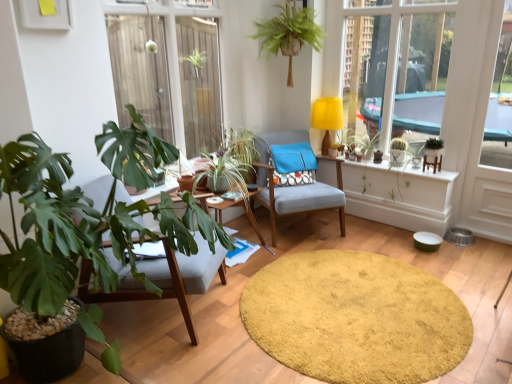
What do you see at coordinates (185, 274) in the screenshot? I see `matte gray chair at left, which is the 2th chair in back-to-front order` at bounding box center [185, 274].

Locate an element on the screen. The width and height of the screenshot is (512, 384). green leafy plant at upper center, the 3th houseplant in the left-to-right sequence is located at coordinates (288, 33).

Describe the element at coordinates (403, 154) in the screenshot. I see `green matte cactus at upper right, which appears as the 2th plant when viewed from the left` at that location.

This screenshot has height=384, width=512. In order to click on green leafy plant at right, which appears as the first houseplant when viewed from the right in this screenshot , I will do `click(433, 149)`.

How much space does green leafy plant at upper right, which ranks as the 2th plant in right-to-left order, occupy horizontally?

green leafy plant at upper right, which ranks as the 2th plant in right-to-left order, is 12.29 inches wide.

This screenshot has height=384, width=512. Describe the element at coordinates (366, 147) in the screenshot. I see `green leafy plant at upper right, which ranks as the 2th plant in right-to-left order` at that location.

Where is `matte gray chair at left, arranged as the first chair when viewed from the front`? This screenshot has width=512, height=384. matte gray chair at left, arranged as the first chair when viewed from the front is located at coordinates (185, 274).

Is green leafy plant at upper center, positioned as the 4th houseplant in back-to-front order, oriented away from woodenobject at center?

green leafy plant at upper center, positioned as the 4th houseplant in back-to-front order, is not turned away from woodenobject at center.

From the picture: Is green leafy plant at upper center, the 3th houseplant in the left-to-right sequence, outside of woodenobject at center?

green leafy plant at upper center, the 3th houseplant in the left-to-right sequence, lies outside woodenobject at center's area.

Which object is closer to the camera, green leafy plant at upper center, placed as the second houseplant when sorted from front to back, or woodenobject at center?

Positioned in front is woodenobject at center.

From a real-world perspective, is yellow fabric lampshade at upper center physically above green leafy plant at upper right, the 1th plant in the left-to-right sequence?

Yes, from a real-world perspective, yellow fabric lampshade at upper center is over green leafy plant at upper right, the 1th plant in the left-to-right sequence

Considering the sizes of yellow fabric lampshade at upper center and green leafy plant at upper right, the 1th plant in the left-to-right sequence, in the image, is yellow fabric lampshade at upper center bigger or smaller than green leafy plant at upper right, the 1th plant in the left-to-right sequence,?

Clearly, yellow fabric lampshade at upper center is smaller in size than green leafy plant at upper right, the 1th plant in the left-to-right sequence.

Is yellow fabric lampshade at upper center positioned far away from green leafy plant at upper right, the 1th plant in the left-to-right sequence?

yellow fabric lampshade at upper center is actually quite close to green leafy plant at upper right, the 1th plant in the left-to-right sequence.

Between green leafy plant at upper right, the 1th plant in the left-to-right sequence, and green matte cactus at upper right, which appears as the 2th plant when viewed from the left, which one appears on the right side from the viewer's perspective?

From the viewer's perspective, green matte cactus at upper right, which appears as the 2th plant when viewed from the left, appears more on the right side.

Considering the relative sizes of green leafy plant at upper right, which ranks as the 2th plant in right-to-left order, and green matte cactus at upper right, which appears as the 2th plant when viewed from the left, in the image provided, is green leafy plant at upper right, which ranks as the 2th plant in right-to-left order, shorter than green matte cactus at upper right, which appears as the 2th plant when viewed from the left,?

Incorrect, the height of green leafy plant at upper right, which ranks as the 2th plant in right-to-left order, does not fall short of that of green matte cactus at upper right, which appears as the 2th plant when viewed from the left.

Based on the photo, from the image's perspective, would you say green leafy plant at upper right, which ranks as the 2th plant in right-to-left order, is positioned over green matte cactus at upper right, which appears as the first plant when viewed from the right?

Yes, from the image's perspective, green leafy plant at upper right, which ranks as the 2th plant in right-to-left order, is over green matte cactus at upper right, which appears as the first plant when viewed from the right.

From a real-world perspective, which is physically above, green leafy plant at upper right, which ranks as the 2th plant in right-to-left order, or green matte cactus at upper right, which appears as the first plant when viewed from the right?

In real-world perspective, green leafy plant at upper right, which ranks as the 2th plant in right-to-left order, is above.

Between blue fabric pillow at center and green leafy plant at right, the 3th houseplant from the back, which one has smaller size?

Smaller between the two is green leafy plant at right, the 3th houseplant from the back.

From a real-world perspective, is blue fabric pillow at center positioned above or below green leafy plant at right, which appears as the first houseplant when viewed from the right?

blue fabric pillow at center is situated lower than green leafy plant at right, which appears as the first houseplant when viewed from the right, in the real world.

Find the location of a particular element. houseplant that is the 4th one above the blue fabric pillow at center (from a real-world perspective) is located at coordinates (433, 149).

From the image's perspective, between blue fabric pillow at center and green leafy plant at right, acting as the third houseplant starting from the front, which one is located above?

From the image's view, green leafy plant at right, acting as the third houseplant starting from the front, is above.

In the scene shown: Considering the relative sizes of woodenobject at center and green leafy plant at upper right, which ranks as the 2th plant in right-to-left order, in the image provided, is woodenobject at center wider than green leafy plant at upper right, which ranks as the 2th plant in right-to-left order,?

Indeed, woodenobject at center has a greater width compared to green leafy plant at upper right, which ranks as the 2th plant in right-to-left order.

Where is `table below the green leafy plant at upper right, the 1th plant in the left-to-right sequence (from a real-world perspective)`? The height and width of the screenshot is (384, 512). table below the green leafy plant at upper right, the 1th plant in the left-to-right sequence (from a real-world perspective) is located at coordinates (229, 207).

From a real-world perspective, is woodenobject at center physically above green leafy plant at upper right, which ranks as the 2th plant in right-to-left order?

No, from a real-world perspective, woodenobject at center is not above green leafy plant at upper right, which ranks as the 2th plant in right-to-left order.

Which point is more forward, (159, 200) or (367, 139)?

Positioned in front is point (159, 200).

Who is smaller, green leafy plant at center, placed as the 2th houseplant when sorted from back to front, or textured fabric chair at center, which is the first chair from back to front?

Smaller between the two is green leafy plant at center, placed as the 2th houseplant when sorted from back to front.

Would you consider green leafy plant at center, the fourth houseplant when ordered from right to left, to be distant from textured fabric chair at center, positioned as the 2th chair in front-to-back order?

No, green leafy plant at center, the fourth houseplant when ordered from right to left, is not far away from textured fabric chair at center, positioned as the 2th chair in front-to-back order.

From a real-world perspective, is green leafy plant at center, the 2th houseplant viewed from the left, physically located above or below textured fabric chair at center, the second chair from the left?

Clearly, from a real-world perspective, green leafy plant at center, the 2th houseplant viewed from the left, is above textured fabric chair at center, the second chair from the left.

From the image's perspective, is green leafy plant at center, which ranks as the 4th houseplant in front-to-back order, on top of textured fabric chair at center, the 1th chair when ordered from right to left?

Indeed, from the image's perspective, green leafy plant at center, which ranks as the 4th houseplant in front-to-back order, is shown above textured fabric chair at center, the 1th chair when ordered from right to left.

Which object is positioned more to the left, yellow fabric at upper right or green leafy plant at left, the 5th houseplant viewed from the back?

green leafy plant at left, the 5th houseplant viewed from the back, is more to the left.

Considering the relative sizes of yellow fabric at upper right and green leafy plant at left, the 5th houseplant viewed from the back, in the image provided, is yellow fabric at upper right shorter than green leafy plant at left, the 5th houseplant viewed from the back,?

In fact, yellow fabric at upper right may be taller than green leafy plant at left, the 5th houseplant viewed from the back.

This screenshot has width=512, height=384. Find the location of `bay window behind the green leafy plant at left, the 5th houseplant viewed from the back`. bay window behind the green leafy plant at left, the 5th houseplant viewed from the back is located at coordinates (398, 62).

From a real-world perspective, who is located higher, yellow fabric at upper right or green leafy plant at left, placed as the first houseplant when sorted from left to right?

In real-world perspective, yellow fabric at upper right is above.

From the woodenobject at center, count 1st houseplants backward and point to it. Please provide its 2D coordinates.

[(288, 33)]

Identify the location of lamp to the left of green leafy plant at upper right, which ranks as the 2th plant in right-to-left order. The width and height of the screenshot is (512, 384). (327, 118).

Based on their spatial positions, is transparent glass window at upper left or yellow shaggy rug at center closer to green leafy plant at upper center, placed as the second houseplant when sorted from front to back?

Among the two, transparent glass window at upper left is located nearer to green leafy plant at upper center, placed as the second houseplant when sorted from front to back.

Which object lies further to the anchor point blue fabric pillow at center, transparent glass window at upper left or green leafy plant at upper right, which ranks as the 2th plant in right-to-left order?

transparent glass window at upper left lies further to blue fabric pillow at center than the other object.

When comparing their distances from yellow fabric at upper right, does matte gray chair at left, which is the 2th chair in back-to-front order, or green matte cactus at upper right, which appears as the first plant when viewed from the right, seem further?

matte gray chair at left, which is the 2th chair in back-to-front order, is further to yellow fabric at upper right.

Considering their positions, is green leafy plant at right, acting as the third houseplant starting from the front, positioned closer to yellow shaggy rug at center than woodenobject at center?

Based on the image, woodenobject at center appears to be nearer to yellow shaggy rug at center.

When comparing their distances from matte gray chair at left, which is the 2th chair in back-to-front order, does transparent glass window at upper left or green leafy plant at upper right, the 1th plant in the left-to-right sequence, seem closer?

transparent glass window at upper left.

Considering their positions, is green matte cactus at upper right, placed as the 1th houseplant when sorted from back to front, positioned closer to green leafy plant at left, the first houseplant from the front, than green leafy plant at center, which ranks as the 4th houseplant in front-to-back order?

Based on the image, green leafy plant at center, which ranks as the 4th houseplant in front-to-back order, appears to be nearer to green leafy plant at left, the first houseplant from the front.

When comparing their distances from green leafy plant at upper center, the 3th houseplant in the left-to-right sequence, does green leafy plant at upper right, which ranks as the 2th plant in right-to-left order, or green matte cactus at upper right, which appears as the first plant when viewed from the right, seem further?

Based on the image, green matte cactus at upper right, which appears as the first plant when viewed from the right, appears to be further to green leafy plant at upper center, the 3th houseplant in the left-to-right sequence.

Looking at the image, which one is located closer to green leafy plant at upper center, placed as the second houseplant when sorted from front to back, green matte cactus at upper right, placed as the 1th houseplant when sorted from back to front, or matte black pot at center?

Among the two, green matte cactus at upper right, placed as the 1th houseplant when sorted from back to front, is located nearer to green leafy plant at upper center, placed as the second houseplant when sorted from front to back.

Identify the location of window situated between matte gray chair at left, which ranks as the 2th chair in right-to-left order, and yellow fabric at upper right from left to right. (169, 69).

The width and height of the screenshot is (512, 384). In order to click on bay window between textured fabric chair at center, which is the first chair from back to front, and green leafy plant at right, acting as the third houseplant starting from the front in this screenshot , I will do `click(398, 62)`.

Where is `flowerpot between yellow fabric lampshade at upper center and green leafy plant at right, the 3th houseplant from the back, from left to right`? flowerpot between yellow fabric lampshade at upper center and green leafy plant at right, the 3th houseplant from the back, from left to right is located at coordinates (377, 156).

Where is `pillow situated between transparent glass window at upper left and green leafy plant at right, placed as the 5th houseplant when sorted from left to right, from left to right`? This screenshot has height=384, width=512. pillow situated between transparent glass window at upper left and green leafy plant at right, placed as the 5th houseplant when sorted from left to right, from left to right is located at coordinates (292, 164).